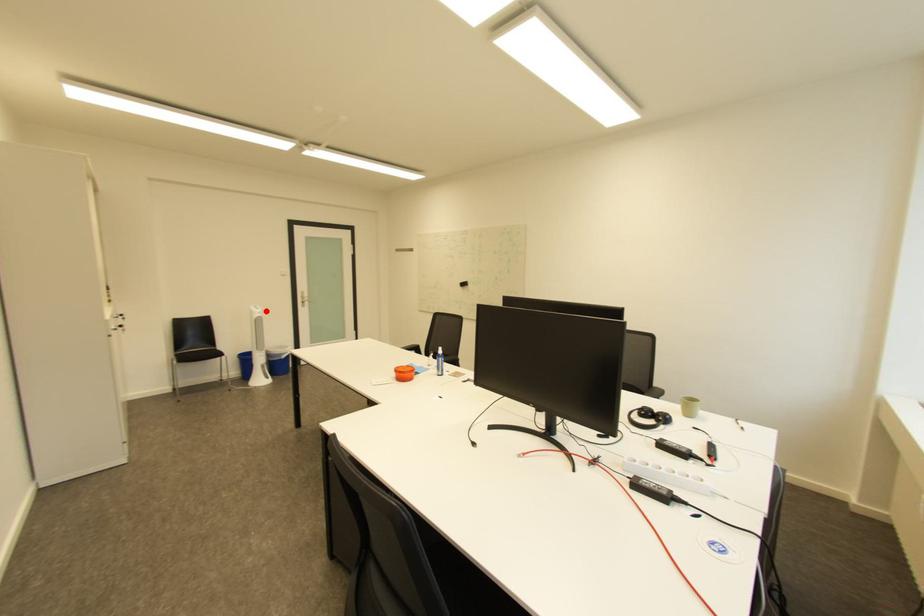
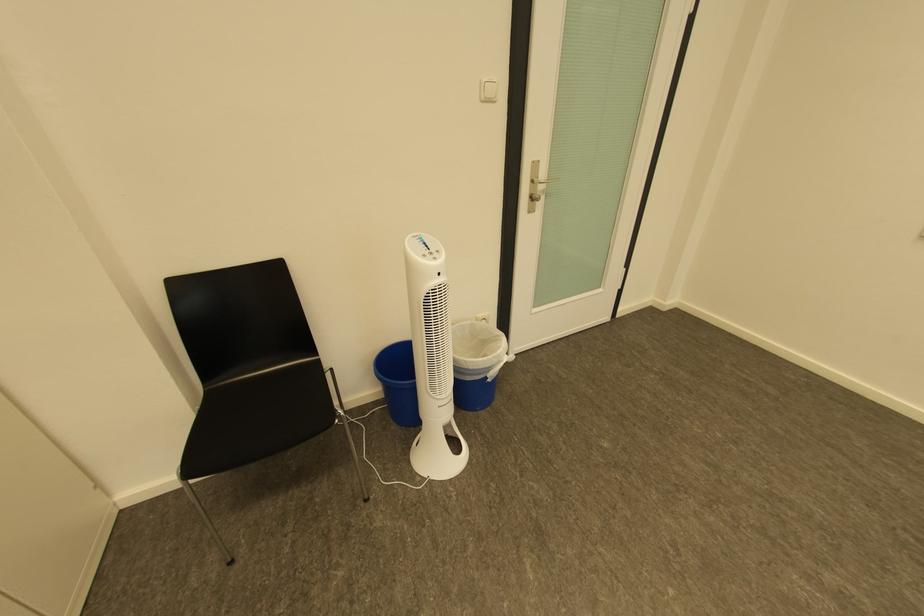
Where in the second image is the point corresponding to the highlighted location from the first image?

(439, 262)